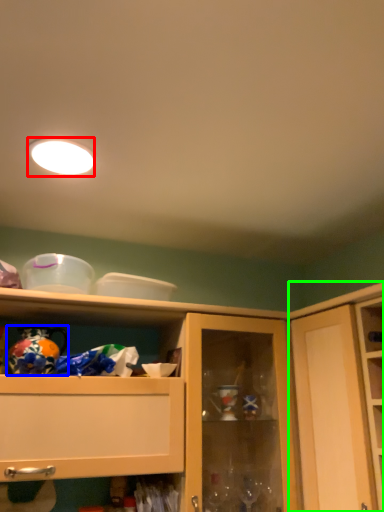
Question: Which object is the farthest from lighting (highlighted by a red box)? Choose among these: toy (highlighted by a blue box) or cupboard (highlighted by a green box).

Choices:
 (A) toy
 (B) cupboard

Answer: (B)